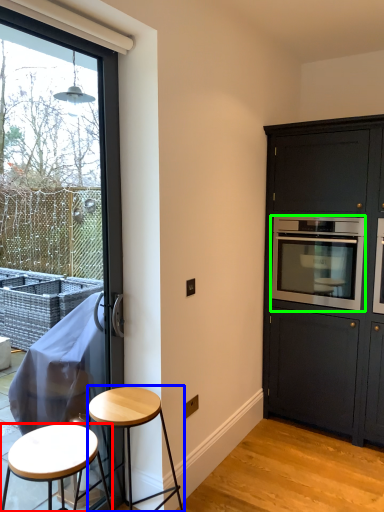
Question: Which object is the farthest from stool (highlighted by a red box)? Choose among these: stool (highlighted by a blue box) or oven (highlighted by a green box).

Choices:
 (A) stool
 (B) oven

Answer: (B)